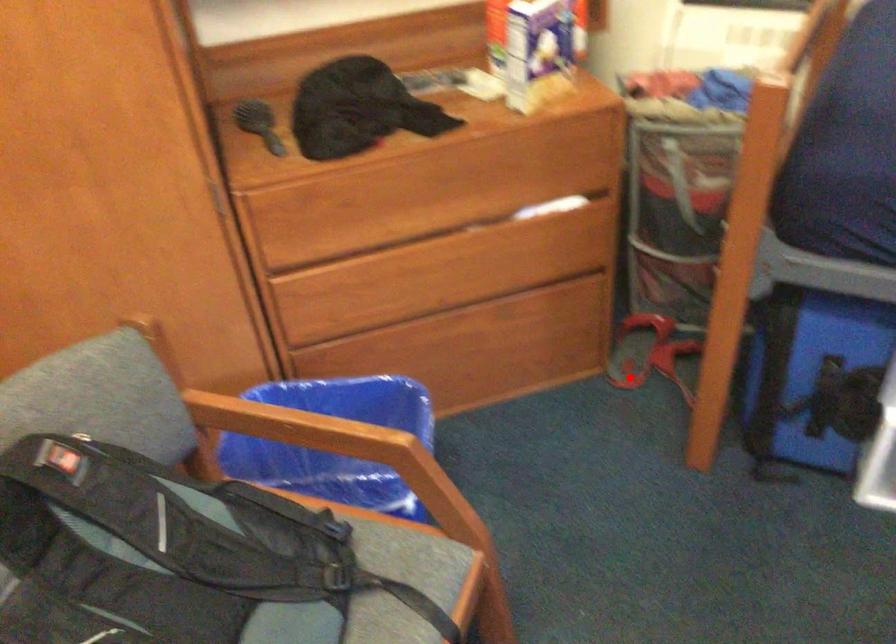
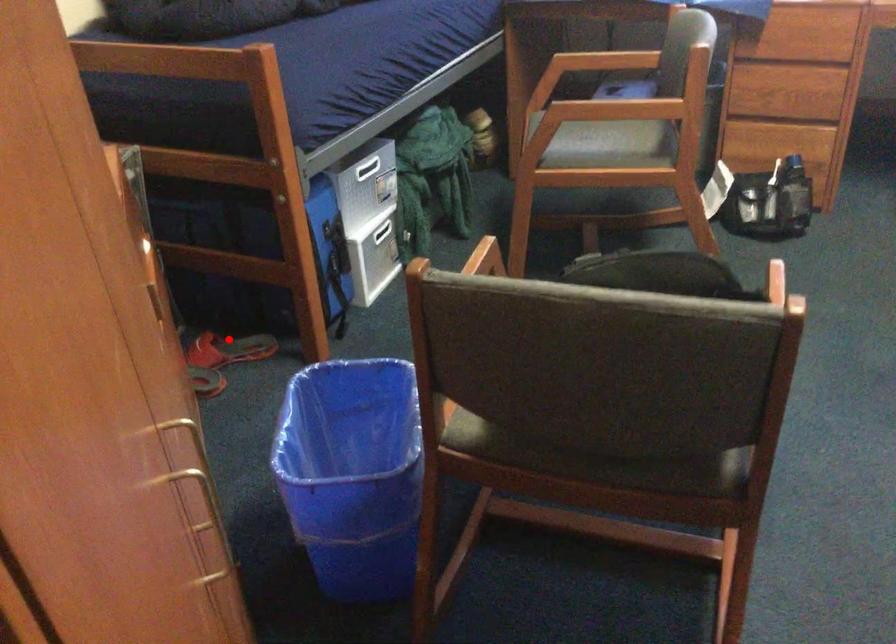
I am providing you with two images of the same scene from different viewpoints. A red point is marked on the first image and another point is marked on the second image. Do the highlighted points in image1 and image2 indicate the same real-world spot?

No